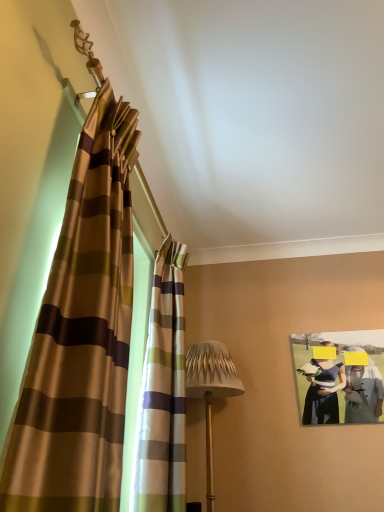
Question: Is textured beige lampshade at center not close to matte paper photo frame at upper right?

Choices:
 (A) yes
 (B) no

Answer: (B)

Question: Is textured beige lampshade at center beside matte paper photo frame at upper right?

Choices:
 (A) no
 (B) yes

Answer: (A)

Question: Is textured beige lampshade at center positioned beyond the bounds of matte paper photo frame at upper right?

Choices:
 (A) yes
 (B) no

Answer: (A)

Question: Can you confirm if textured beige lampshade at center is bigger than matte paper photo frame at upper right?

Choices:
 (A) yes
 (B) no

Answer: (A)

Question: Is textured beige lampshade at center at the right side of matte paper photo frame at upper right?

Choices:
 (A) no
 (B) yes

Answer: (A)

Question: In terms of width, does textured beige lampshade at center look wider or thinner when compared to matte paper photo frame at upper right?

Choices:
 (A) wide
 (B) thin

Answer: (A)

Question: From a real-world perspective, relative to matte paper photo frame at upper right, is textured beige lampshade at center vertically above or below?

Choices:
 (A) below
 (B) above

Answer: (A)

Question: Is textured beige lampshade at center bigger or smaller than matte paper photo frame at upper right?

Choices:
 (A) big
 (B) small

Answer: (A)

Question: In terms of height, does textured beige lampshade at center look taller or shorter compared to matte paper photo frame at upper right?

Choices:
 (A) tall
 (B) short

Answer: (A)

Question: In the image, is striped fabric curtain at left, which is the first curtain from back to front, positioned in front of or behind textured beige lampshade at center?

Choices:
 (A) behind
 (B) front

Answer: (B)

Question: Based on their positions, is striped fabric curtain at left, which is the 2th curtain in front-to-back order, located to the left or right of textured beige lampshade at center?

Choices:
 (A) left
 (B) right

Answer: (A)

Question: Would you say striped fabric curtain at left, which is the 2th curtain in front-to-back order, is inside or outside textured beige lampshade at center?

Choices:
 (A) outside
 (B) inside

Answer: (A)

Question: Considering the positions of striped fabric curtain at left, which is the first curtain from back to front, and textured beige lampshade at center in the image, is striped fabric curtain at left, which is the first curtain from back to front, wider or thinner than textured beige lampshade at center?

Choices:
 (A) thin
 (B) wide

Answer: (A)

Question: In terms of height, does striped fabric curtain at left, which is the 2th curtain in front-to-back order, look taller or shorter compared to silky brown striped curtain at left, the second curtain viewed from the back?

Choices:
 (A) tall
 (B) short

Answer: (A)

Question: Is point (157, 480) closer or farther from the camera than point (87, 198)?

Choices:
 (A) farther
 (B) closer

Answer: (A)